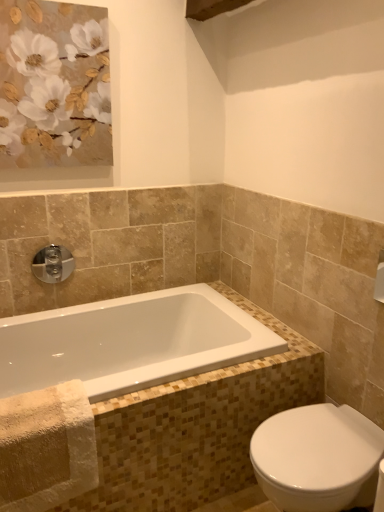
Locate an element on the screen. This screenshot has height=512, width=384. free point above white glossy bidet at lower right (from a real-world perspective) is located at coordinates (322, 437).